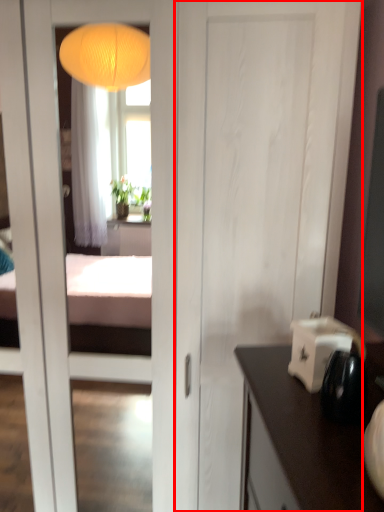
Question: From the image's perspective, what is the correct spatial relationship of door (annotated by the red box) in relation to appliance?

Choices:
 (A) above
 (B) below

Answer: (A)